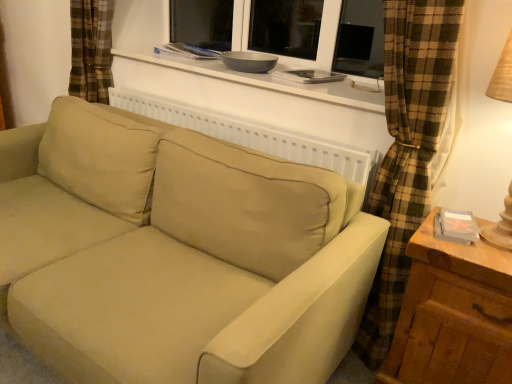
Question: From the image's perspective, relative to white matte window sill at upper center, is wooden at right above or below?

Choices:
 (A) below
 (B) above

Answer: (A)

Question: Would you say wooden at right is to the left or to the right of white matte window sill at upper center in the picture?

Choices:
 (A) right
 (B) left

Answer: (A)

Question: Estimate the real-world distances between objects in this image. Which object is farther from the beige fabric couch at center?

Choices:
 (A) white matte window sill at upper center
 (B) wooden at right

Answer: (A)

Question: Which object is the closest to the beige fabric couch at center?

Choices:
 (A) white matte window sill at upper center
 (B) wooden at right

Answer: (B)